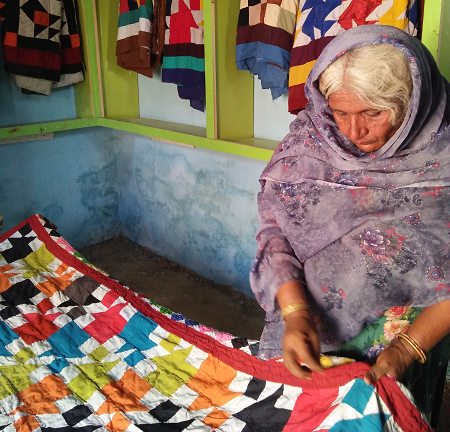
Locate an element on the screen. cubby in shelf is located at coordinates pos(171,100).